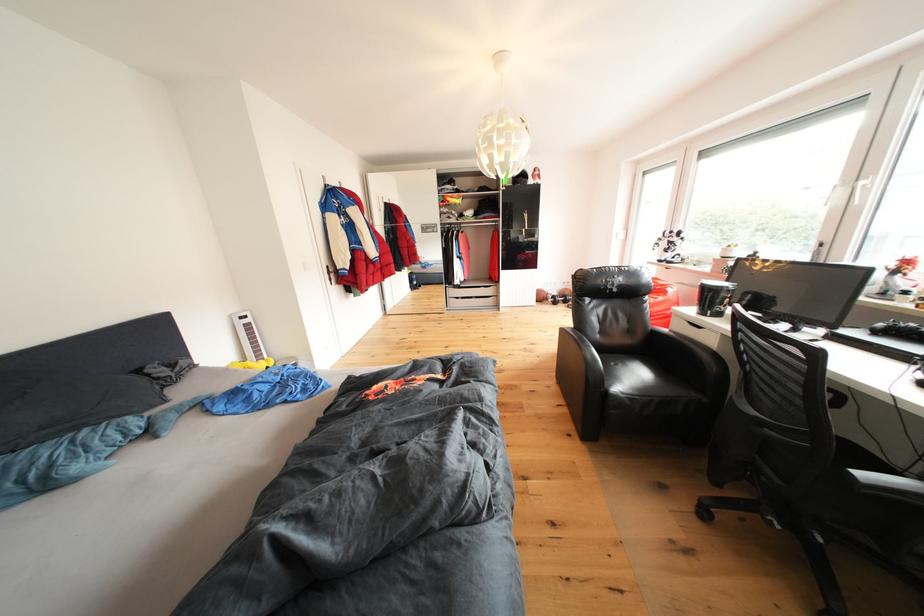
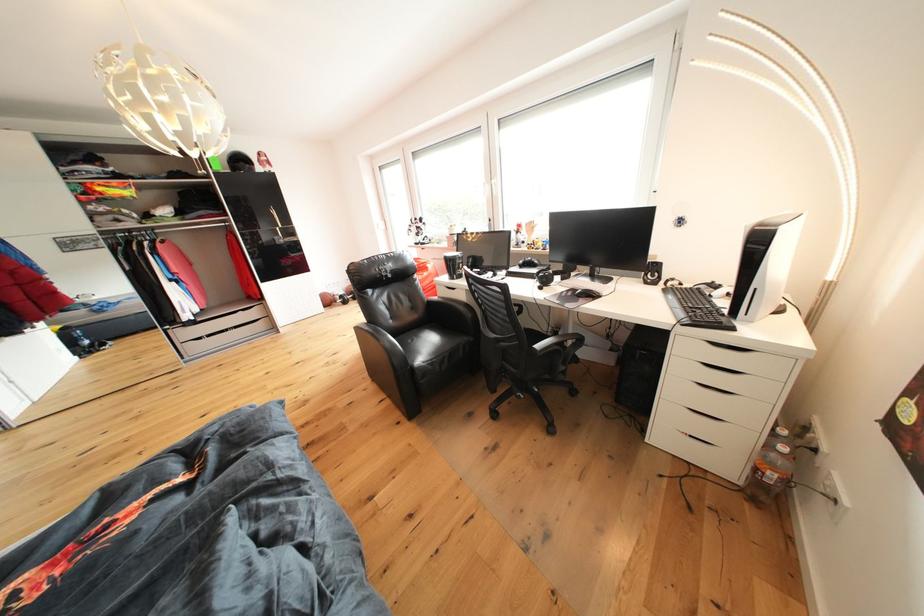
Question: Based on the continuous images, in which direction is the camera rotating? Reply with the corresponding letter.

Choices:
 (A) Left
 (B) Right
 (C) Up
 (D) Down

Answer: (B)